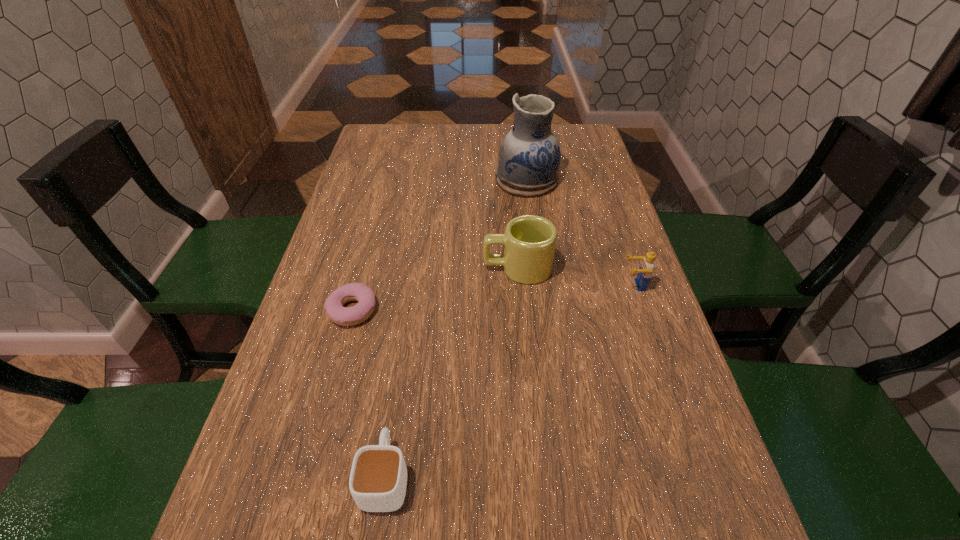
The width and height of the screenshot is (960, 540). In order to click on free area in between the mug and the doughnut in this screenshot , I will do `click(435, 289)`.

The height and width of the screenshot is (540, 960). I want to click on free point between the Lego and the cup, so click(x=510, y=381).

Identify the location of empty location between the tallest object and the nearest object. This screenshot has width=960, height=540. (456, 328).

Find the location of a particular element. free space between the tallest object and the third tallest object is located at coordinates (580, 233).

Image resolution: width=960 pixels, height=540 pixels. Identify the location of free space between the doughnut and the rightmost object. (493, 298).

Where is `vacant region between the mug and the third tallest object`? vacant region between the mug and the third tallest object is located at coordinates (576, 276).

This screenshot has height=540, width=960. Find the location of `blank region between the doughnut and the nearest object`. blank region between the doughnut and the nearest object is located at coordinates (369, 393).

The height and width of the screenshot is (540, 960). In order to click on free space between the tallest object and the third tallest object in this screenshot , I will do `click(580, 233)`.

Select which object is the closest to the second object from left to right. Please provide its 2D coordinates. Your answer should be formatted as a tuple, i.e. [(x, y)], where the tuple contains the x and y coordinates of a point satisfying the conditions above.

[(346, 316)]

What are the coordinates of `object that stands as the third closest to the mug` in the screenshot? It's located at coord(346,316).